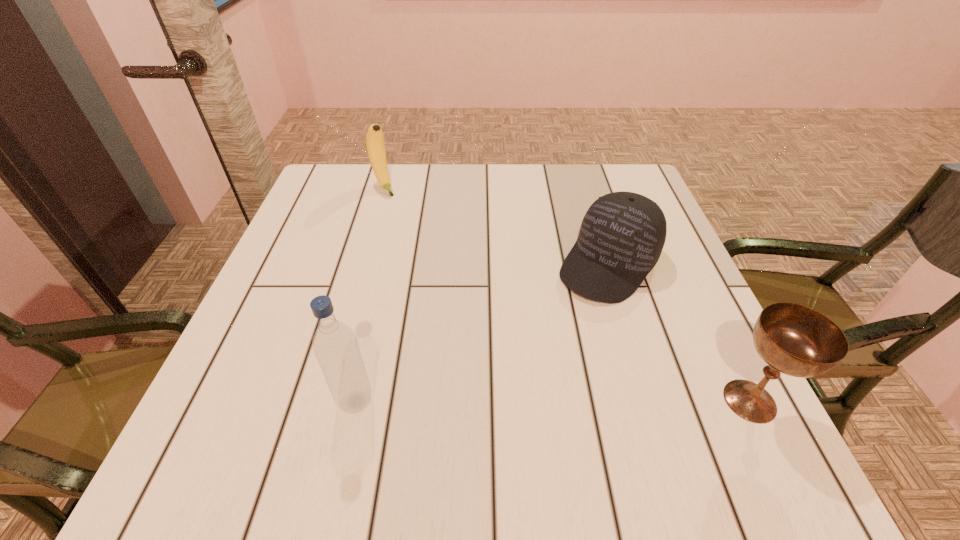
Where is `vacant space in between the chalice and the baseball cap`? vacant space in between the chalice and the baseball cap is located at coordinates (679, 333).

I want to click on unoccupied area between the shortest object and the farthest object, so click(496, 226).

Where is `free space between the baseball cap and the chalice`? This screenshot has height=540, width=960. free space between the baseball cap and the chalice is located at coordinates (679, 333).

The height and width of the screenshot is (540, 960). Find the location of `free space between the baseball cap and the farthest object`. free space between the baseball cap and the farthest object is located at coordinates (496, 226).

Identify the location of free space between the tallest object and the chalice. The width and height of the screenshot is (960, 540). (553, 401).

At what (x,y) coordinates should I click in order to perform the action: click on free space between the chalice and the tallest object. Please return your answer as a coordinate pair (x, y). This screenshot has width=960, height=540. Looking at the image, I should click on (553, 401).

Where is `empty location between the second farthest object and the tallest object`? This screenshot has width=960, height=540. empty location between the second farthest object and the tallest object is located at coordinates (482, 333).

The height and width of the screenshot is (540, 960). Identify the location of blank region between the chalice and the farthest object. (566, 294).

At what (x,y) coordinates should I click in order to perform the action: click on object that can be found as the second closest to the water bottle. Please return your answer as a coordinate pair (x, y). This screenshot has width=960, height=540. Looking at the image, I should click on (793, 339).

Point out which object is positioned as the second nearest to the baseball cap. Please provide its 2D coordinates. Your answer should be formatted as a tuple, i.e. [(x, y)], where the tuple contains the x and y coordinates of a point satisfying the conditions above.

[(335, 345)]